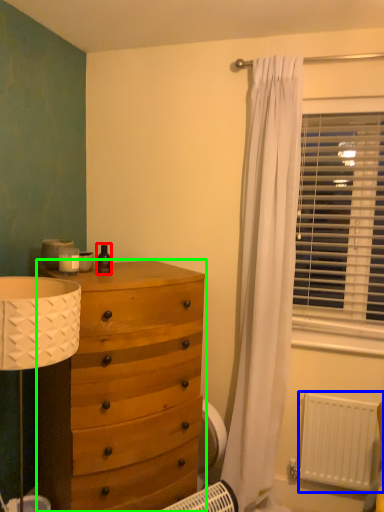
Question: Estimate the real-world distances between objects in this image. Which object is farther from toiletry (highlighted by a red box), radiator (highlighted by a blue box) or chest of drawers (highlighted by a green box)?

Choices:
 (A) radiator
 (B) chest of drawers

Answer: (A)